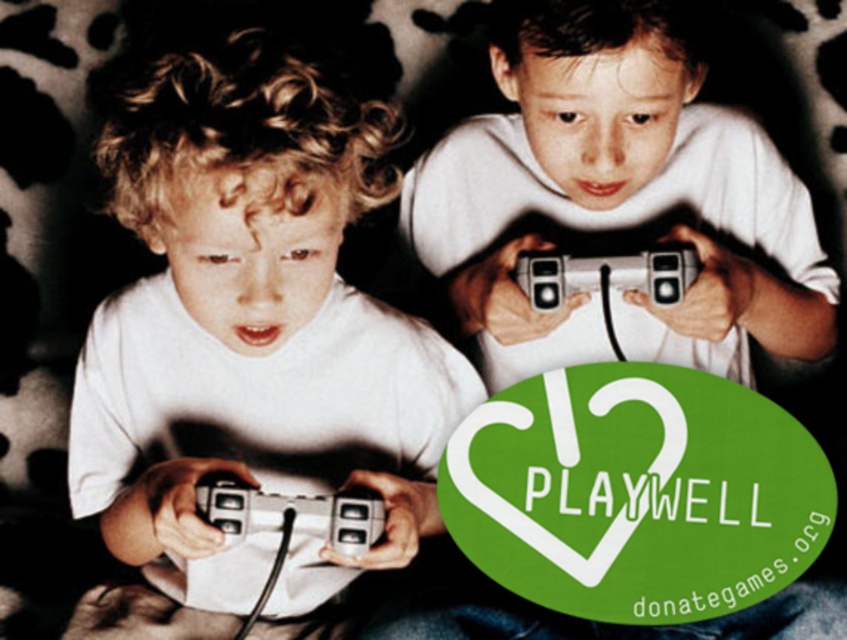
Is matte white shirt at center shorter than metallic silver game controller at lower center?

Incorrect, matte white shirt at center's height does not fall short of metallic silver game controller at lower center's.

Can you confirm if matte white shirt at center is taller than metallic silver game controller at lower center?

Indeed, matte white shirt at center has a greater height compared to metallic silver game controller at lower center.

Which is behind, point (174, 304) or point (364, 506)?

The point (174, 304) is behind.

This screenshot has height=640, width=847. Identify the location of matte white shirt at center. (252, 330).

Measure the distance between matte white shirt at center and silver metallic controller at center.

matte white shirt at center and silver metallic controller at center are 28.95 centimeters apart.

Which of these two, matte white shirt at center or silver metallic controller at center, stands shorter?

silver metallic controller at center is shorter.

This screenshot has height=640, width=847. Find the location of `matte white shirt at center`. matte white shirt at center is located at coordinates (252, 330).

Can you confirm if metallic silver game controller at lower center is taller than silver metallic controller at center?

Correct, metallic silver game controller at lower center is much taller as silver metallic controller at center.

Find the location of a particular element. metallic silver game controller at lower center is located at coordinates (292, 515).

The width and height of the screenshot is (847, 640). What do you see at coordinates (292, 515) in the screenshot?
I see `metallic silver game controller at lower center` at bounding box center [292, 515].

Find the location of a particular element. This screenshot has height=640, width=847. metallic silver game controller at lower center is located at coordinates (292, 515).